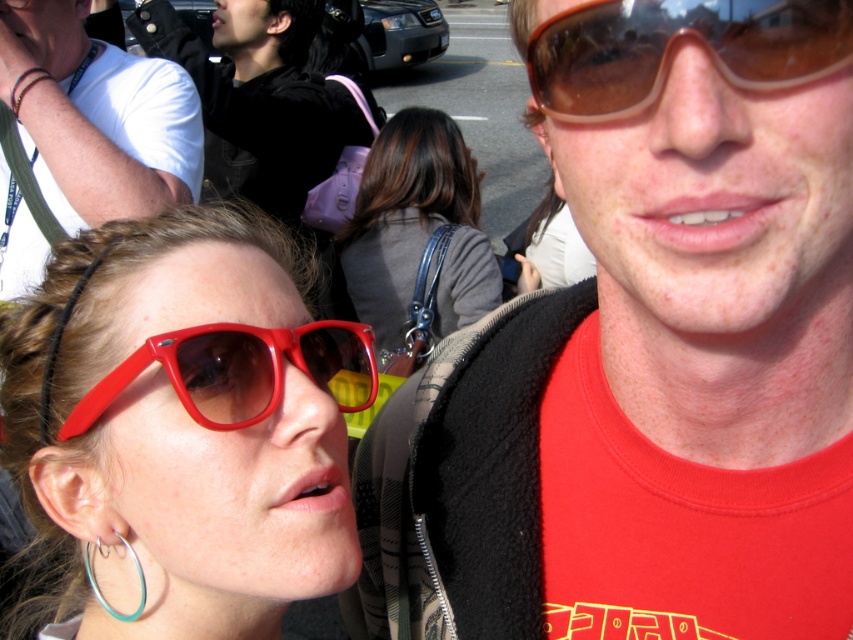
You are a photographer standing in the middle of the scene. You want to take a photo that includes both the black fabric jacket at upper left and the brown translucent goggles at upper right. Is there enough space between them for you to capture both in a single frame?

The black fabric jacket at upper left and brown translucent goggles at upper right are 2.67 meters apart. Since the distance between them is manageable within a typical camera frame, you can capture both in a single photo.

You are holding a 12 inch ruler and want to measure the distance between yourself and the point at coordinates point (227, 410). Can you reach it without moving your hand?

The distance between you and the point at coordinates point (227, 410) is 25.18 inches, so you cannot reach it with a 12 inch ruler without moving your hand.